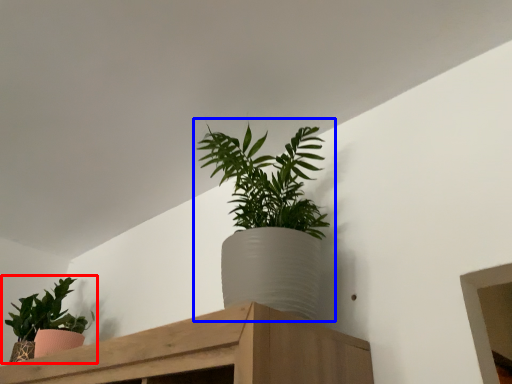
Question: Which point is closer to the camera, houseplant (highlighted by a red box) or houseplant (highlighted by a blue box)?

Choices:
 (A) houseplant
 (B) houseplant

Answer: (B)